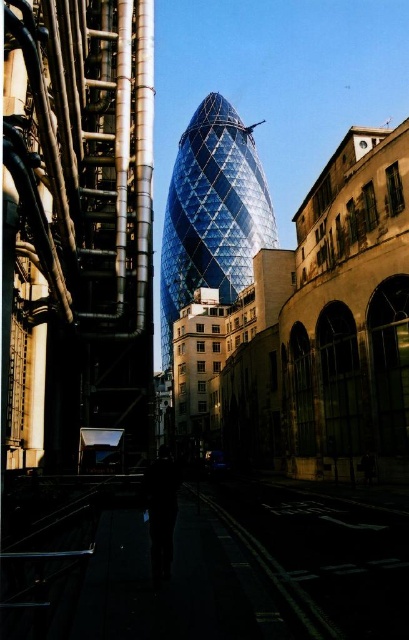
Question: Is white reflective pavement at lower center further to camera compared to shiny glass tower at center?

Choices:
 (A) yes
 (B) no

Answer: (B)

Question: Which point is closer to the camera?

Choices:
 (A) white reflective pavement at lower center
 (B) shiny glass tower at center

Answer: (A)

Question: Is white reflective pavement at lower center thinner than shiny glass tower at center?

Choices:
 (A) yes
 (B) no

Answer: (A)

Question: Which point is farther from the camera taking this photo?

Choices:
 (A) (184, 160)
 (B) (328, 513)

Answer: (A)

Question: Is white reflective pavement at lower center smaller than shiny glass tower at center?

Choices:
 (A) no
 (B) yes

Answer: (B)